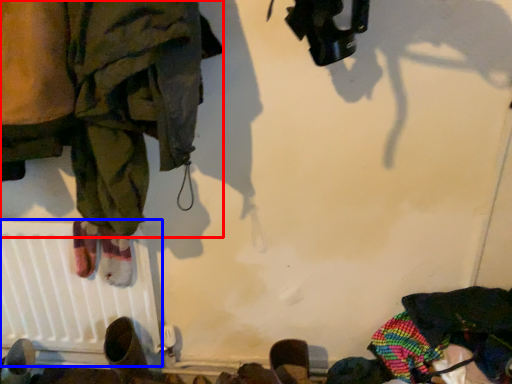
Question: Which point is further to the camera, clothing (highlighted by a red box) or radiator (highlighted by a blue box)?

Choices:
 (A) clothing
 (B) radiator

Answer: (B)